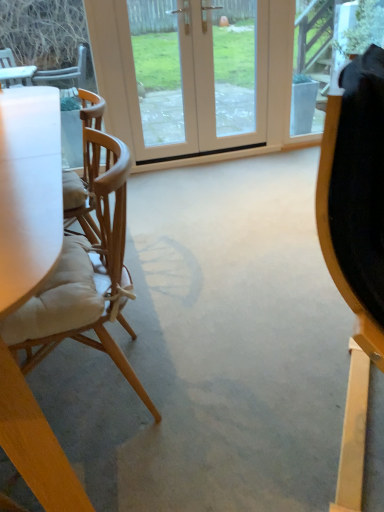
Where is `vacant space underneath light beige fabric chair at left (from a real-world perspective)`? Image resolution: width=384 pixels, height=512 pixels. vacant space underneath light beige fabric chair at left (from a real-world perspective) is located at coordinates (94, 394).